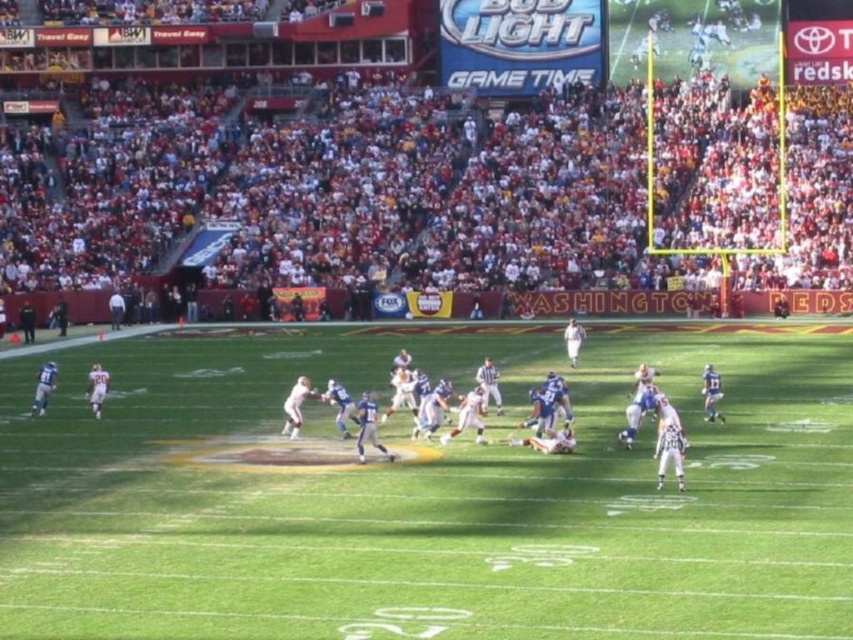
Question: Does white fabric crowd at upper center appear over white matte football players at center?

Choices:
 (A) no
 (B) yes

Answer: (B)

Question: Which point is closer to the camera?

Choices:
 (A) green grass football field at center
 (B) white matte football players at center
 (C) white fabric crowd at upper center

Answer: (A)

Question: Is green grass football field at center below white fabric crowd at upper center?

Choices:
 (A) yes
 (B) no

Answer: (A)

Question: Does green grass football field at center appear on the right side of white matte football players at center?

Choices:
 (A) no
 (B) yes

Answer: (A)

Question: Which of the following is the farthest from the observer?

Choices:
 (A) (28, 154)
 (B) (274, 634)
 (C) (680, 484)

Answer: (A)

Question: Which of the following is the closest to the observer?

Choices:
 (A) (828, 192)
 (B) (440, 387)
 (C) (190, 436)

Answer: (B)